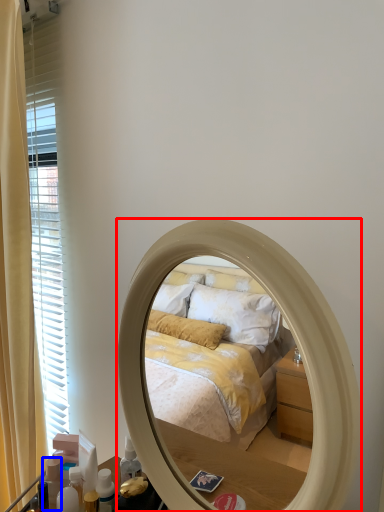
Question: Which point is further to the camera, mirror (highlighted by a red box) or toiletry (highlighted by a blue box)?

Choices:
 (A) mirror
 (B) toiletry

Answer: (B)